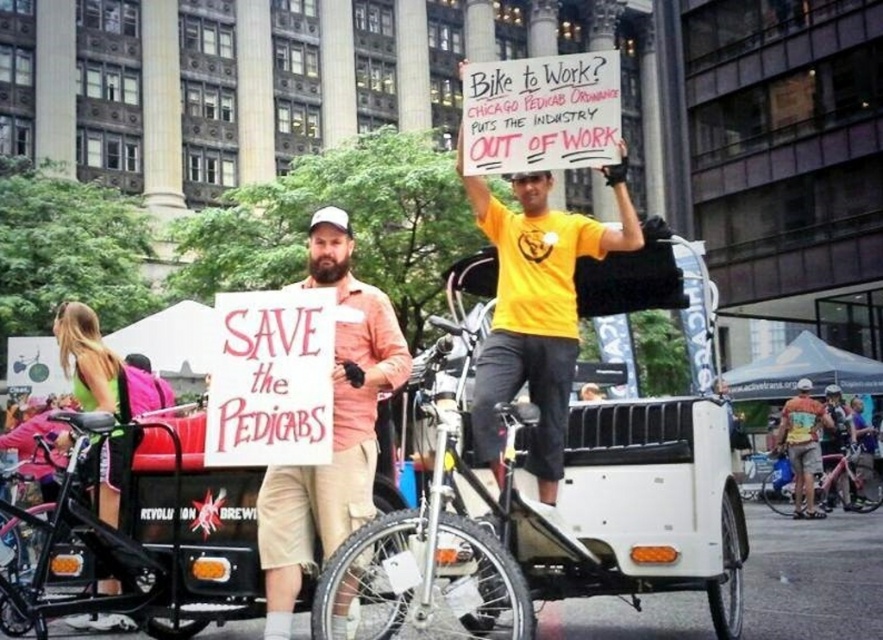
Between silver metallic bicycle at center and metallic silver camera at center, which one appears on the right side from the viewer's perspective?

From the viewer's perspective, metallic silver camera at center appears more on the right side.

The height and width of the screenshot is (640, 883). Find the location of `silver metallic bicycle at center`. silver metallic bicycle at center is located at coordinates (846, 483).

Locate an element on the screen. Image resolution: width=883 pixels, height=640 pixels. silver metallic bicycle at center is located at coordinates (846, 483).

Locate an element on the screen. silver metallic bicycle at center is located at coordinates tap(846, 483).

Can you confirm if beige cotton shorts at center is shorter than metallic silver camera at center?

No, beige cotton shorts at center is not shorter than metallic silver camera at center.

Can you confirm if beige cotton shorts at center is thinner than metallic silver camera at center?

No, beige cotton shorts at center is not thinner than metallic silver camera at center.

Which is in front, point (336, 518) or point (843, 490)?

Point (336, 518) is in front.

At what (x,y) coordinates should I click in order to perform the action: click on beige cotton shorts at center. Please return your answer as a coordinate pair (x, y). Looking at the image, I should click on (331, 428).

This screenshot has height=640, width=883. Find the location of `beige cotton shorts at center`. beige cotton shorts at center is located at coordinates (331, 428).

The width and height of the screenshot is (883, 640). Find the location of `beige cotton shorts at center`. beige cotton shorts at center is located at coordinates (331, 428).